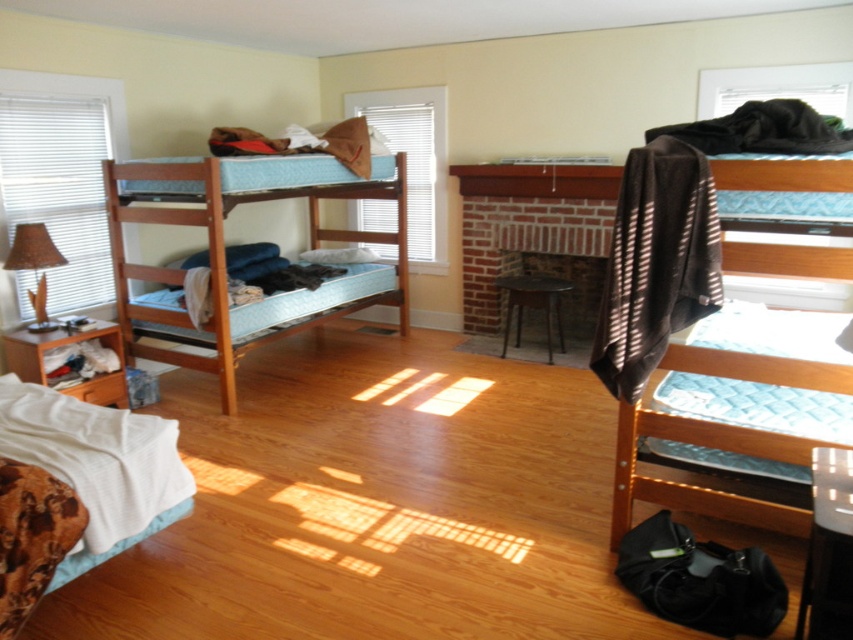
You are a guest staying in this bedroom and need to locate the brown striped towel at upper right and the brown wood drawer at lower left. Which object is positioned higher in the room?

The brown striped towel at upper right is positioned higher in the room than the brown wood drawer at lower left.

Looking at this image, you are standing in the bedroom and see the point marked as point (712, 436). What object is located at this point?

The brown striped towel at upper right is located at point (712, 436).

You are standing in the bedroom and want to grab the brown striped towel at upper right. To reach it, you need to walk past the wooden bunk bed at left. Since both are in your line of sight, which one do you need to step over first?

The brown striped towel at upper right is closer to the viewer than the wooden bunk bed at left, so you need to step over the brown striped towel at upper right first before reaching the wooden bunk bed at left.